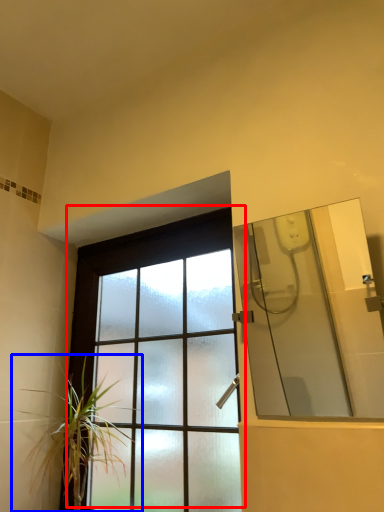
Question: Among these objects, which one is farthest to the camera, window (highlighted by a red box) or houseplant (highlighted by a blue box)?

Choices:
 (A) window
 (B) houseplant

Answer: (B)